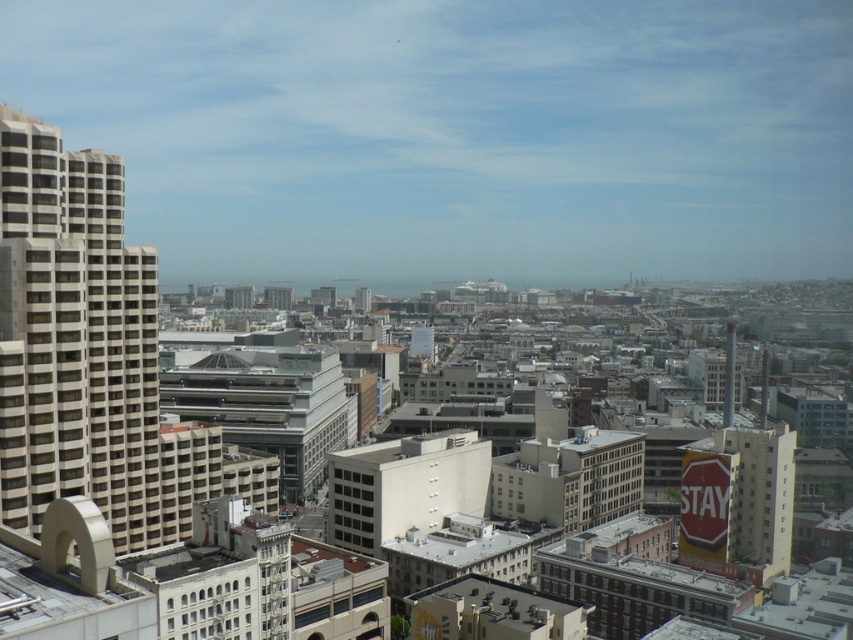
Between beige concrete building at left and red matte stop sign at center-right, which one appears on the left side from the viewer's perspective?

beige concrete building at left is more to the left.

Describe the element at coordinates (76, 336) in the screenshot. I see `beige concrete building at left` at that location.

You are a GUI agent. You are given a task and a screenshot of the screen. Output one action in this format:
    pyautogui.click(x=<x>, y=<y>)
    Task: Click on the beige concrete building at left
    
    Given the screenshot: What is the action you would take?
    pyautogui.click(x=76, y=336)